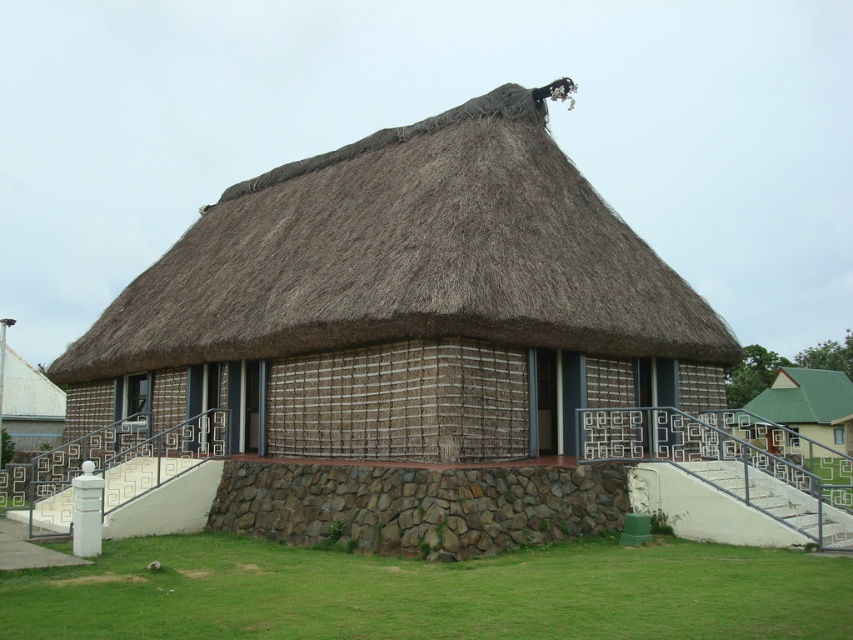
You are an architect evaluating the traditional building. You need to determine which material occupies more space in the central area of the building. Based on the image, which object is larger in size between the brown thatch at center and the brown rough stone wall at center?

The brown thatch at center is bigger than the brown rough stone wall at center, so the brown thatch at center occupies more space in the central area of the building.

You are a visitor standing at the base of the stairs leading to the traditional building. You want to place a decorative stone between the brown thatch at center and the green grass at lower center. Given that the decorative stone is 1 foot in diameter, is there enough space to place it without overlapping either object?

The brown thatch at center and green grass at lower center are 56.87 feet apart. Since the decorative stone is only 1 foot in diameter, there is ample space between them to place it without overlapping either object.